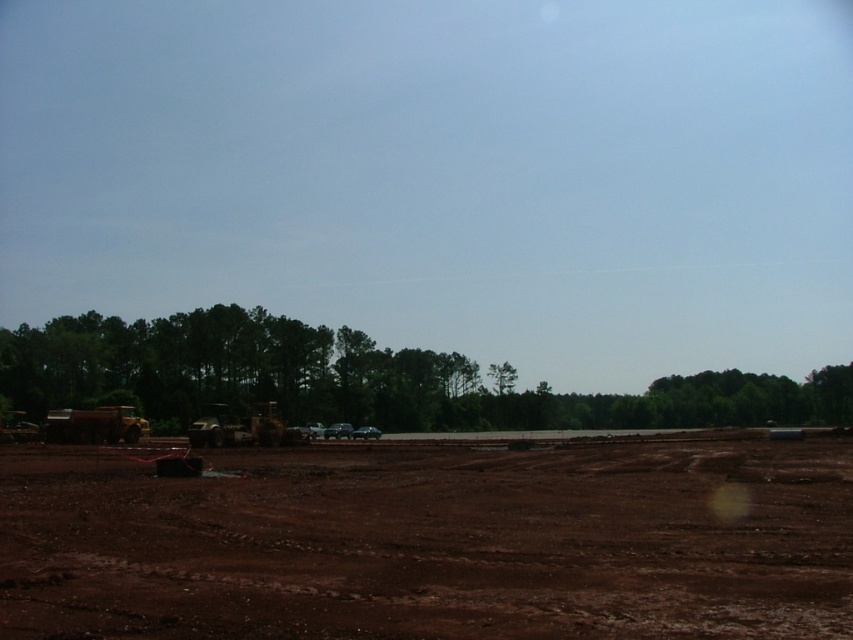
From the picture: Is green leafy trees at center wider than green leafy tree at center?

Correct, the width of green leafy trees at center exceeds that of green leafy tree at center.

Does point (270, 321) come closer to viewer compared to point (515, 378)?

That is True.

Where is `green leafy trees at center`? This screenshot has width=853, height=640. green leafy trees at center is located at coordinates (357, 380).

How much distance is there between brown dirt field at center and green leafy trees at center?

The distance of brown dirt field at center from green leafy trees at center is 92.82 meters.

Between point (64, 595) and point (39, 353), which one is positioned behind?

Point (39, 353)

The width and height of the screenshot is (853, 640). What are the coordinates of `brown dirt field at center` in the screenshot? It's located at (432, 541).

Is brown dirt field at center in front of green leafy tree at center?

Yes, it is in front of green leafy tree at center.

How far apart are brown dirt field at center and green leafy tree at center?

brown dirt field at center and green leafy tree at center are 436.60 feet apart from each other.

This screenshot has width=853, height=640. What do you see at coordinates (432, 541) in the screenshot? I see `brown dirt field at center` at bounding box center [432, 541].

I want to click on brown dirt field at center, so click(x=432, y=541).